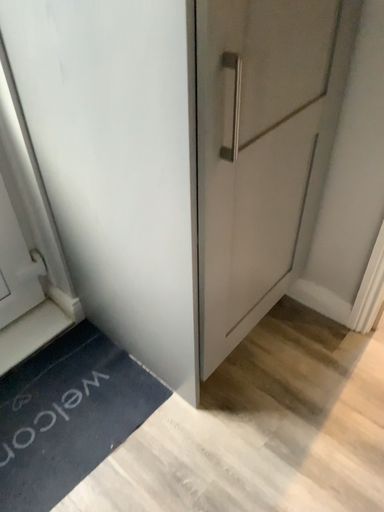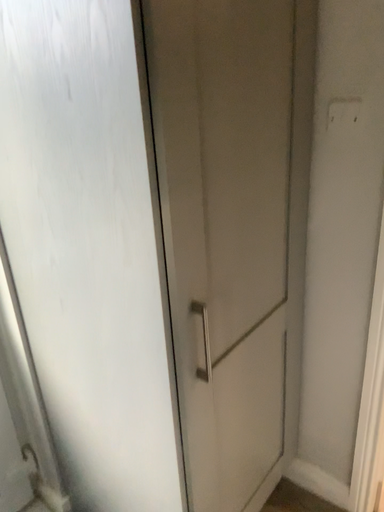
Question: Which way did the camera rotate in the video?

Choices:
 (A) rotated downward
 (B) rotated upward

Answer: (B)